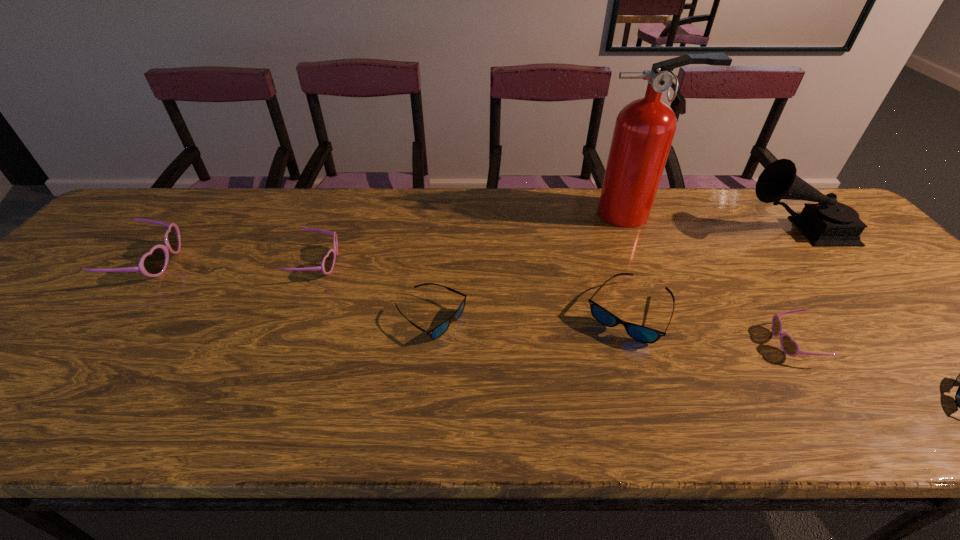
Image resolution: width=960 pixels, height=540 pixels. I want to click on the rightmost pink sunglasses, so click(x=790, y=347).

Image resolution: width=960 pixels, height=540 pixels. What are the coordinates of `the leftmost blue sunglasses` in the screenshot? It's located at (438, 331).

Where is `the second smallest blue sunglasses`? the second smallest blue sunglasses is located at coordinates (438, 331).

I want to click on vacant space located on the right of the tallest object, so click(x=727, y=214).

In order to click on vacant space located from the horn of the black phonograph_record in this screenshot , I will do `click(639, 228)`.

Identify the location of vacant area situated 0.400m from the horn of the black phonograph_record. This screenshot has width=960, height=540. (606, 228).

You are a GUI agent. You are given a task and a screenshot of the screen. Output one action in this format:
    pyautogui.click(x=<x>, y=<y>)
    Task: Click on the free space located 0.280m from the horn of the black phonograph_record
    This screenshot has height=540, width=960.
    Given the screenshot: What is the action you would take?
    pyautogui.click(x=647, y=228)

This screenshot has width=960, height=540. Identify the location of vacant space located on the front-facing side of the third tallest object. (237, 262).

Where is `free spot located on the front-facing side of the second object from left to right`? Image resolution: width=960 pixels, height=540 pixels. free spot located on the front-facing side of the second object from left to right is located at coordinates (411, 263).

Find the location of `vacant space located at the front of the second blue sunglasses from left to right showing the lenses`. vacant space located at the front of the second blue sunglasses from left to right showing the lenses is located at coordinates (660, 411).